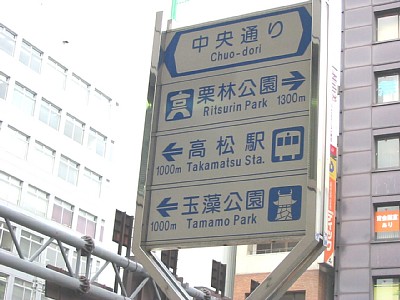
In order to click on rod in this screenshot , I will do `click(76, 243)`, `click(77, 278)`.